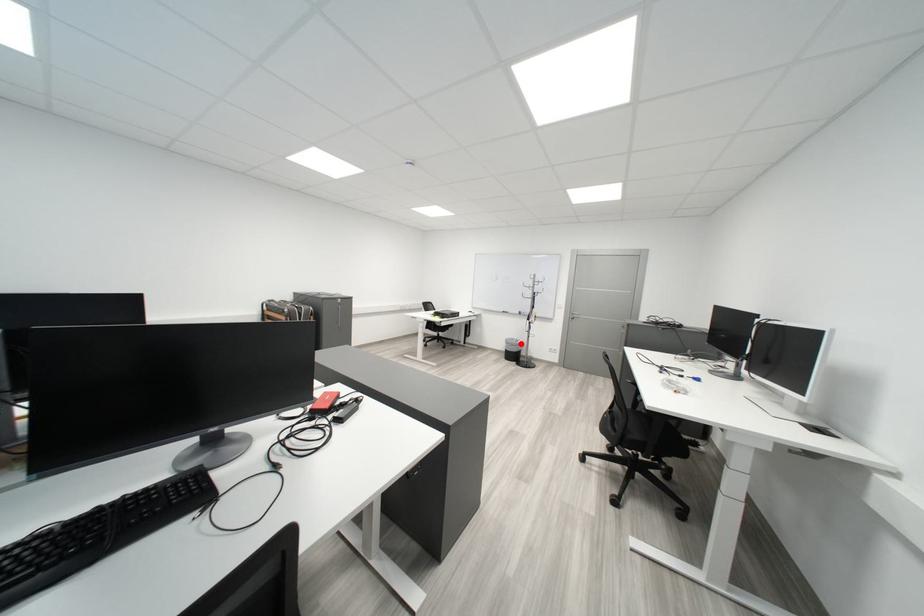
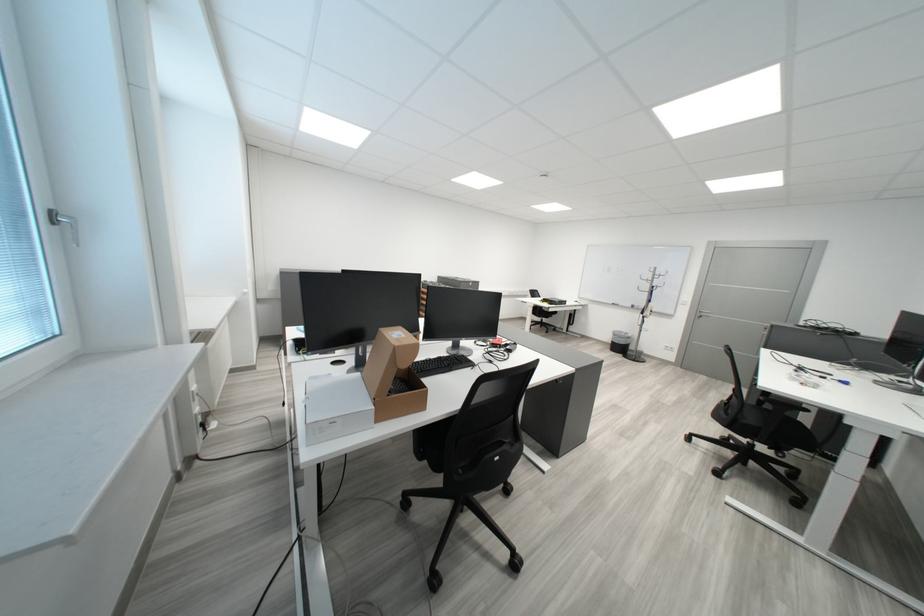
Question: I am providing you with two images of the same scene from different viewpoints. Given a red point in image1, look at the same physical point in image2. Is it:

Choices:
 (A) Closer to the viewpoint
 (B) Farther from the viewpoint

Answer: (B)